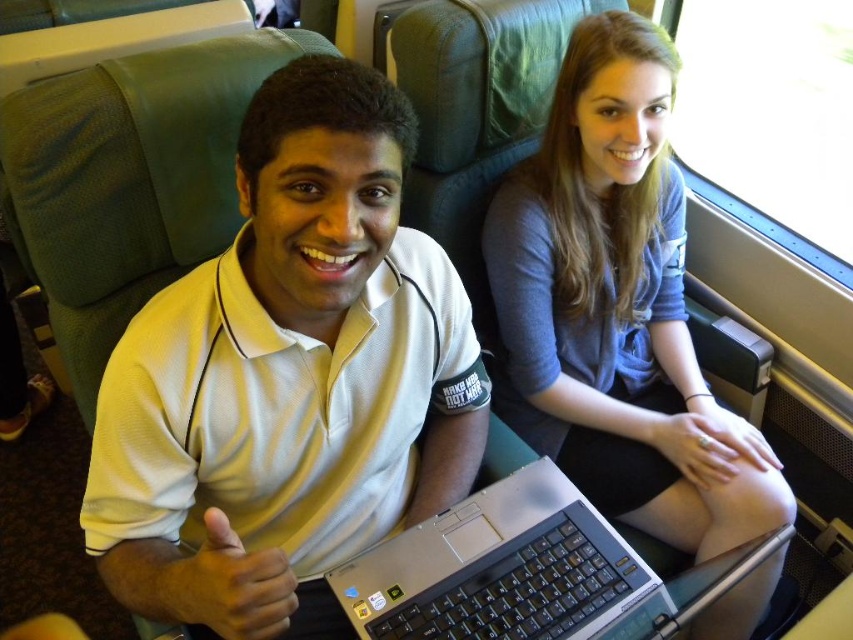
Question: Does white matte shirt at center appear on the right side of silver metallic laptop at center?

Choices:
 (A) no
 (B) yes

Answer: (A)

Question: Is matte gray sweater at upper right below silver metallic laptop at center?

Choices:
 (A) no
 (B) yes

Answer: (A)

Question: Can you confirm if white matte shirt at center is wider than silver metallic laptop at center?

Choices:
 (A) no
 (B) yes

Answer: (A)

Question: Among these points, which one is nearest to the camera?

Choices:
 (A) (352, 614)
 (B) (664, 177)
 (C) (131, 525)

Answer: (C)

Question: Among these points, which one is farthest from the camera?

Choices:
 (A) (752, 470)
 (B) (505, 563)
 (C) (252, 573)

Answer: (A)

Question: Among these points, which one is farthest from the camera?

Choices:
 (A) (260, 570)
 (B) (612, 387)

Answer: (B)